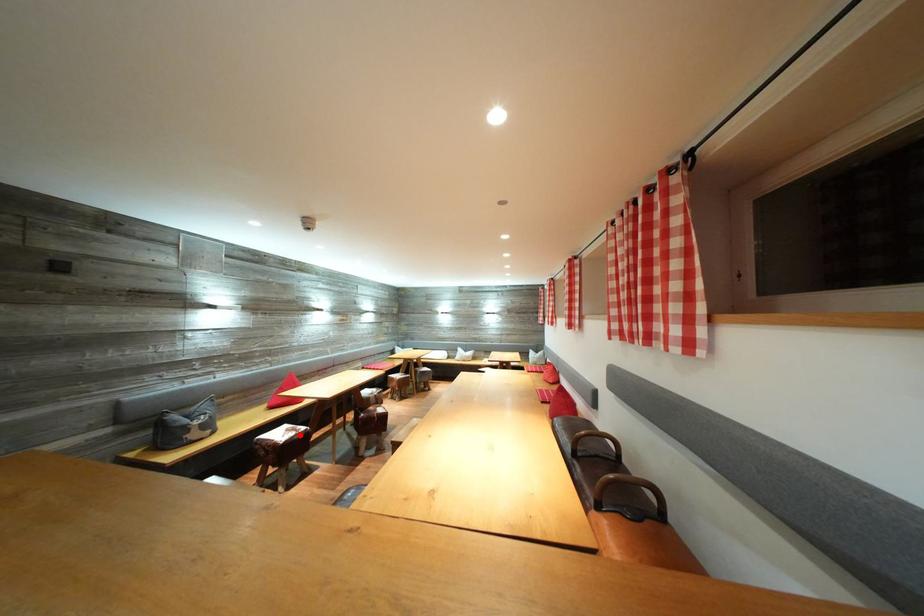
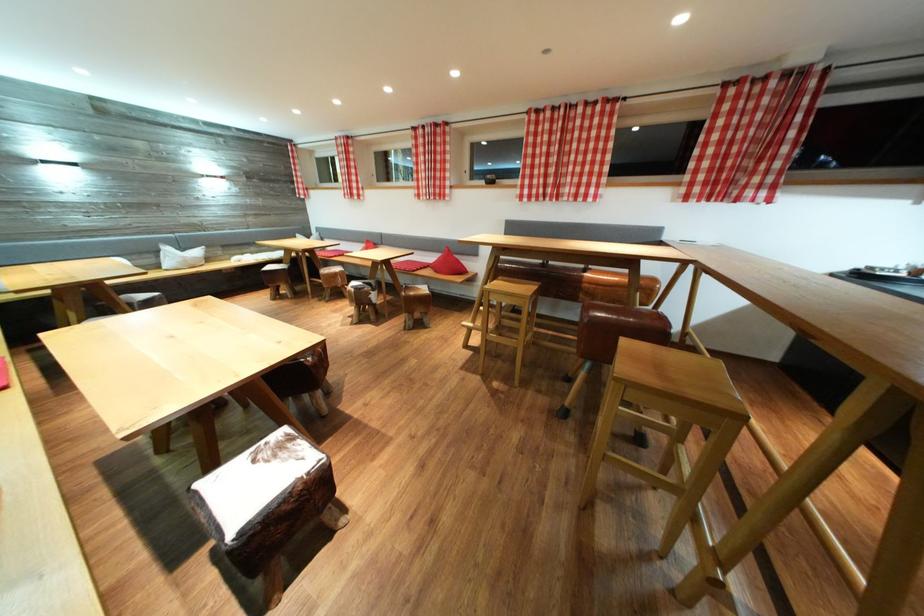
Where in the second image is the point corresponding to the highlighted location from the first image?

(286, 452)